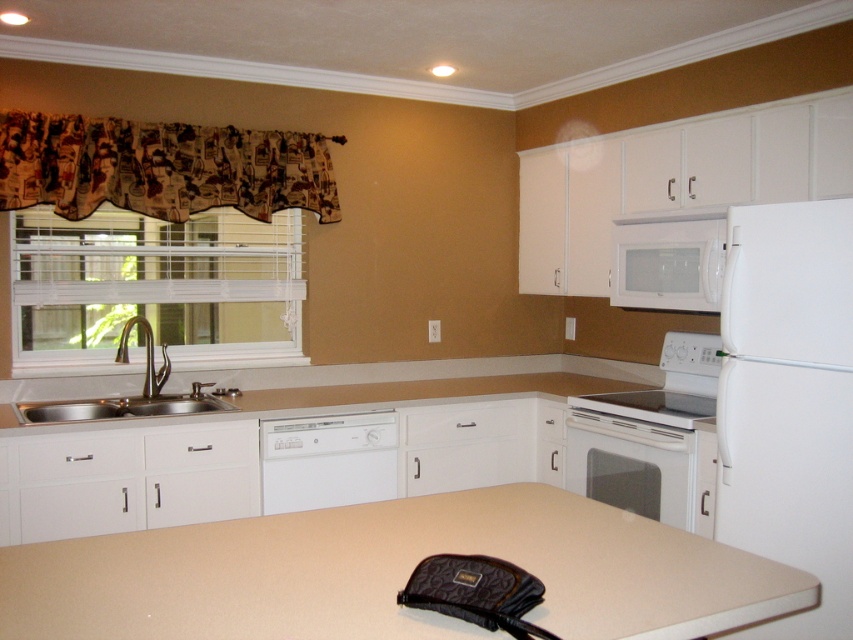
Question: Observing the image, what is the correct spatial positioning of white plastic blinds at left in reference to white glossy oven at lower center?

Choices:
 (A) right
 (B) left

Answer: (B)

Question: Can you confirm if stainless steel sink at left is positioned below white glossy stove at center?

Choices:
 (A) no
 (B) yes

Answer: (A)

Question: Can you confirm if stainless steel sink at left is positioned to the left of white glossy stove at center?

Choices:
 (A) no
 (B) yes

Answer: (B)

Question: Which point appears closest to the camera in this image?

Choices:
 (A) (122, 548)
 (B) (627, 413)
 (C) (579, 428)

Answer: (A)

Question: Which object is closer to the camera taking this photo?

Choices:
 (A) white glossy oven at lower center
 (B) stainless steel sink at left
 (C) white plastic blinds at left

Answer: (B)

Question: Which of the following is the closest to the observer?

Choices:
 (A) (606, 458)
 (B) (663, 428)
 (C) (126, 292)

Answer: (B)